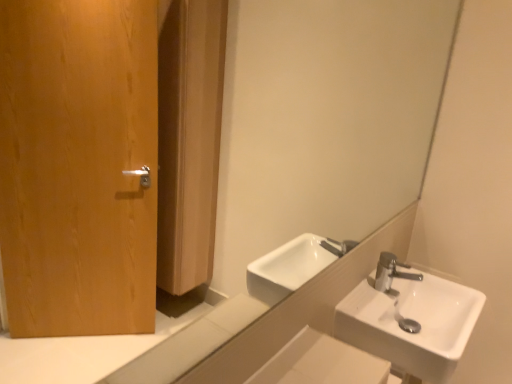
Question: In terms of width, does white glossy mirror at upper center look wider or thinner when compared to white ceramic sink at right?

Choices:
 (A) wide
 (B) thin

Answer: (B)

Question: In terms of height, does white glossy mirror at upper center look taller or shorter compared to white ceramic sink at right?

Choices:
 (A) short
 (B) tall

Answer: (B)

Question: Considering their positions, is white glossy mirror at upper center located in front of or behind white ceramic sink at right?

Choices:
 (A) front
 (B) behind

Answer: (A)

Question: From a real-world perspective, is white ceramic sink at right physically located above or below white glossy mirror at upper center?

Choices:
 (A) above
 (B) below

Answer: (B)

Question: Relative to white glossy mirror at upper center, is white ceramic sink at right in front or behind?

Choices:
 (A) front
 (B) behind

Answer: (B)

Question: Is point (342, 309) positioned closer to the camera than point (204, 342)?

Choices:
 (A) closer
 (B) farther

Answer: (B)

Question: Is white ceramic sink at right spatially inside white glossy mirror at upper center, or outside of it?

Choices:
 (A) inside
 (B) outside

Answer: (B)